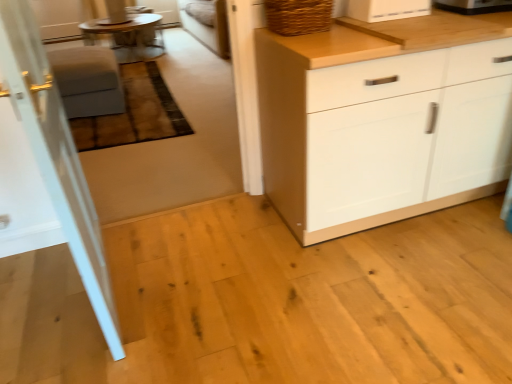
You are a GUI agent. You are given a task and a screenshot of the screen. Output one action in this format:
    pyautogui.click(x=<x>, y=<y>)
    Task: Click on the free space to the left of white glossy door at left
    
    Given the screenshot: What is the action you would take?
    [x=46, y=284]